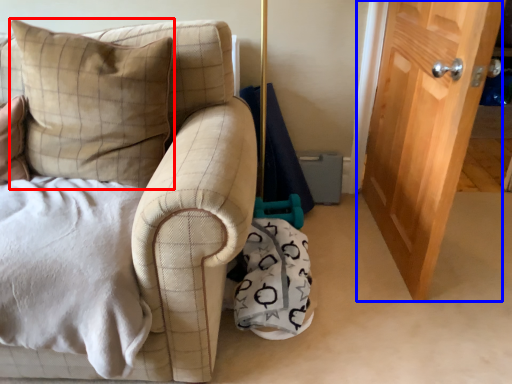
Question: Among these objects, which one is farthest to the camera, pillow (highlighted by a red box) or door (highlighted by a blue box)?

Choices:
 (A) pillow
 (B) door

Answer: (B)